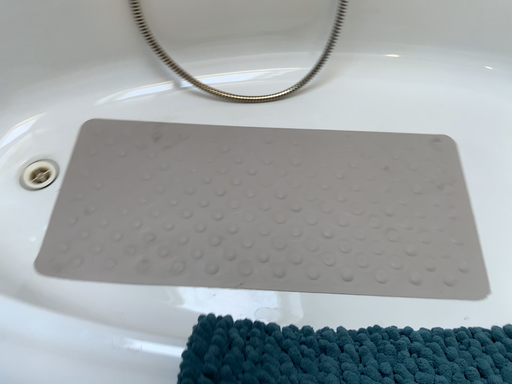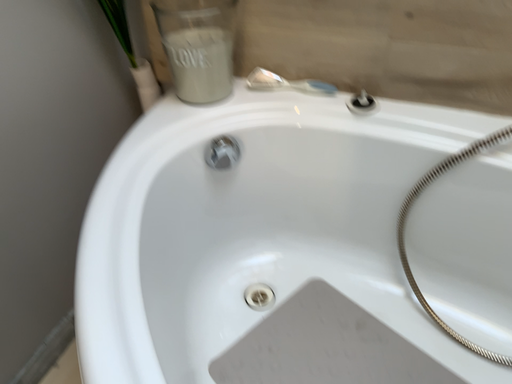
Question: Which way did the camera rotate in the video?

Choices:
 (A) rotated downward
 (B) rotated upward

Answer: (B)